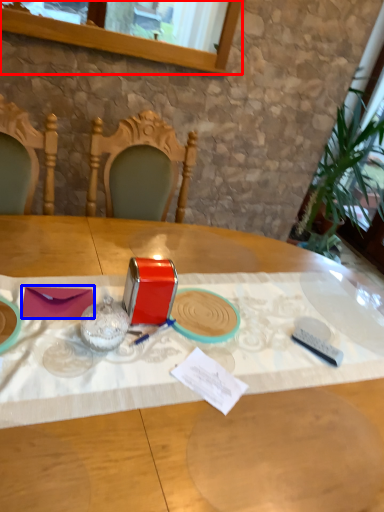
Question: Among these objects, which one is farthest to the camera, window (highlighted by a red box) or notepad (highlighted by a blue box)?

Choices:
 (A) window
 (B) notepad

Answer: (A)